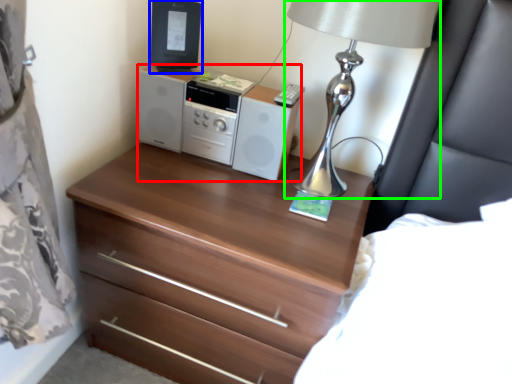
Question: Based on their relative distances, which object is nearer to stereo (highlighted by a red box)? Choose from desktop computer (highlighted by a blue box) and table lamp (highlighted by a green box).

Choices:
 (A) desktop computer
 (B) table lamp

Answer: (A)